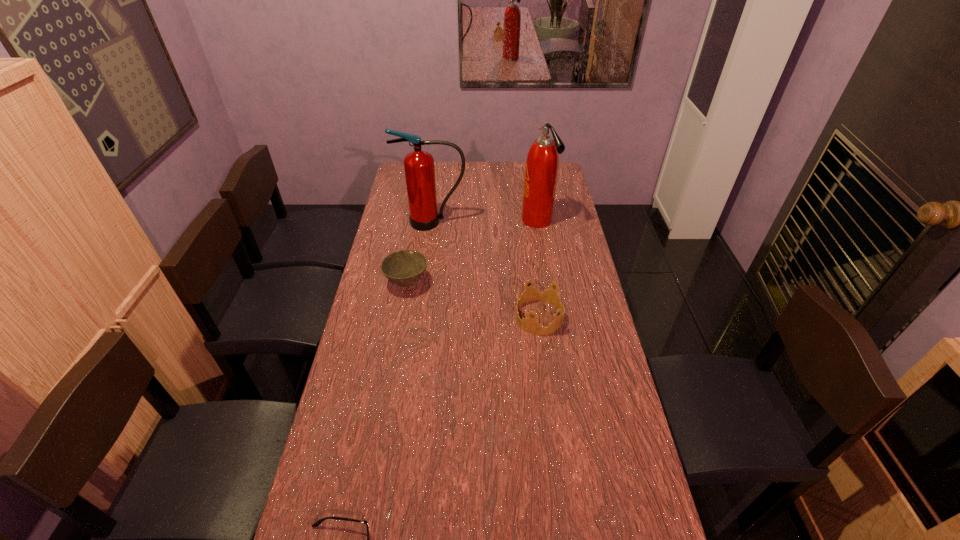
Where is `fire extinguisher situated at the left edge`? The height and width of the screenshot is (540, 960). fire extinguisher situated at the left edge is located at coordinates (419, 168).

What are the coordinates of `bowl that is at the left edge` in the screenshot? It's located at (404, 268).

I want to click on fire extinguisher that is positioned at the right edge, so click(x=541, y=169).

The image size is (960, 540). What are the coordinates of `tiara located in the right edge section of the desktop` in the screenshot? It's located at (530, 325).

Find the location of a particular element. free region at the far edge of the desktop is located at coordinates (448, 178).

What are the coordinates of `vacant area at the left edge of the desktop` in the screenshot? It's located at (363, 362).

In the image, there is a desktop. Where is `vacant space at the right edge`? The width and height of the screenshot is (960, 540). vacant space at the right edge is located at coordinates (587, 444).

Where is `free spot between the fourth farthest object and the right fire extinguisher`? Image resolution: width=960 pixels, height=540 pixels. free spot between the fourth farthest object and the right fire extinguisher is located at coordinates [538, 269].

Find the location of a particular element. vacant region between the second nearest object and the left fire extinguisher is located at coordinates (486, 270).

You are a GUI agent. You are given a task and a screenshot of the screen. Output one action in this format:
    pyautogui.click(x=<x>, y=<y>)
    Task: Click on the empty space between the second nearest object and the right fire extinguisher
    
    Given the screenshot: What is the action you would take?
    pyautogui.click(x=538, y=269)